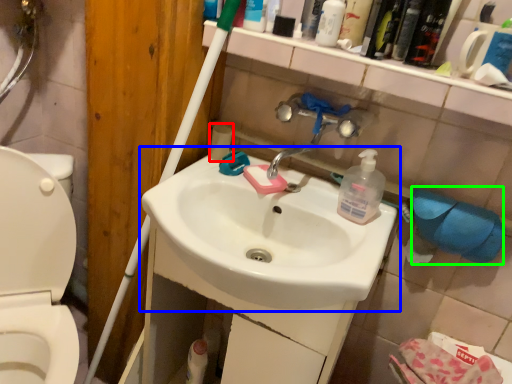
Question: Which object is the farthest from toilet paper (highlighted by a red box)? Choose among these: sink (highlighted by a blue box) or toilet paper (highlighted by a green box).

Choices:
 (A) sink
 (B) toilet paper

Answer: (B)